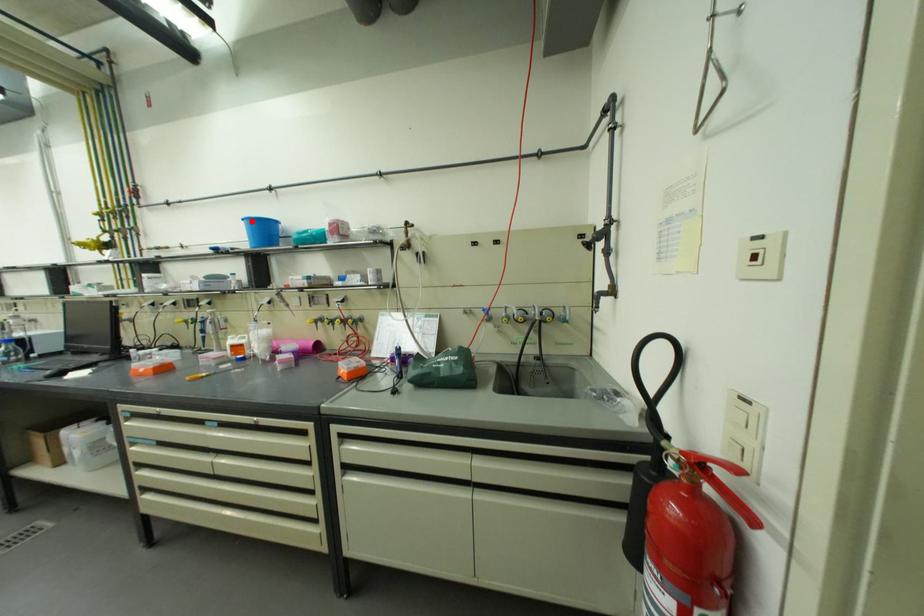
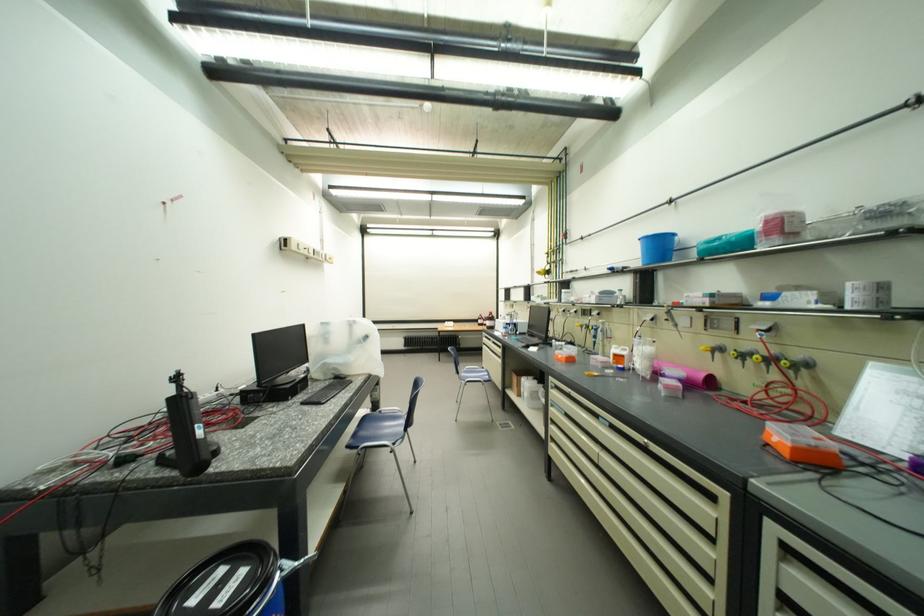
In the second image, find the point that corresponds to the highlighted location in the first image.

(649, 241)